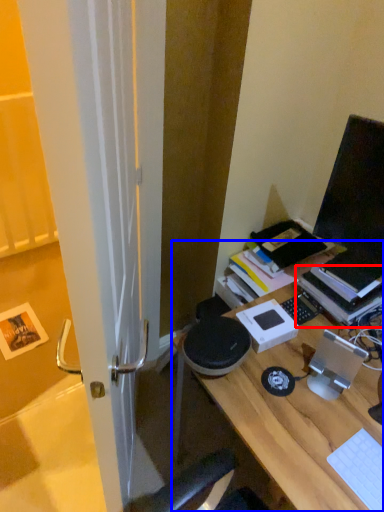
Question: Which object appears closest to the camera in this image, paperback book (highlighted by a red box) or desk (highlighted by a blue box)?

Choices:
 (A) paperback book
 (B) desk

Answer: (B)